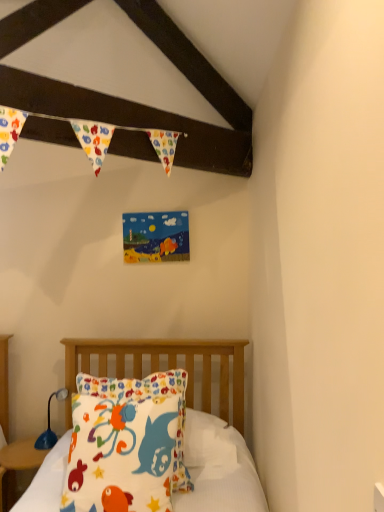
Image resolution: width=384 pixels, height=512 pixels. What do you see at coordinates (21, 455) in the screenshot? I see `matte wood nightstand at lower left` at bounding box center [21, 455].

What do you see at coordinates (126, 441) in the screenshot? This screenshot has height=512, width=384. I see `fluffy cotton pillow at lower left` at bounding box center [126, 441].

Describe the element at coordinates (189, 406) in the screenshot. I see `white cotton pillow at center` at that location.

This screenshot has width=384, height=512. Describe the element at coordinates (49, 424) in the screenshot. I see `blue plastic lamp at lower left` at that location.

Identify the location of matte wood nightstand at lower left. The height and width of the screenshot is (512, 384). (21, 455).

Between fluffy cotton pillow at lower left and blue plastic lamp at lower left, which one has smaller size?

With smaller size is blue plastic lamp at lower left.

Are fluffy cotton pillow at lower left and blue plastic lamp at lower left far apart?

fluffy cotton pillow at lower left is actually quite close to blue plastic lamp at lower left.

From the picture: How many degrees apart are the facing directions of fluffy cotton pillow at lower left and blue plastic lamp at lower left?

The facing directions of fluffy cotton pillow at lower left and blue plastic lamp at lower left are 34.7 degrees apart.

From a real-world perspective, is fluffy cotton pillow at lower left positioned above or below blue plastic lamp at lower left?

From a real-world perspective, fluffy cotton pillow at lower left is physically above blue plastic lamp at lower left.

Is white cotton pillow at center looking in the opposite direction of fluffy cotton pillow at lower left?

Absolutely, white cotton pillow at center is directed away from fluffy cotton pillow at lower left.

I want to click on pillow above the white cotton pillow at center (from a real-world perspective), so click(126, 441).

From the image's perspective, is white cotton pillow at center located beneath fluffy cotton pillow at lower left?

Yes, from the image's perspective, white cotton pillow at center is below fluffy cotton pillow at lower left.

How many degrees apart are the facing directions of fluffy cotton pillow at lower left and matte wood nightstand at lower left?

17.5 degrees separate the facing orientations of fluffy cotton pillow at lower left and matte wood nightstand at lower left.

Is fluffy cotton pillow at lower left at the right side of matte wood nightstand at lower left?

Correct, you'll find fluffy cotton pillow at lower left to the right of matte wood nightstand at lower left.

Which object is closer to the camera, fluffy cotton pillow at lower left or matte wood nightstand at lower left?

fluffy cotton pillow at lower left is closer to the camera.

Is white cotton pillow at center inside or outside of matte wood nightstand at lower left?

white cotton pillow at center is outside matte wood nightstand at lower left.

Is point (154, 364) closer or farther from the camera than point (31, 445)?

Point (154, 364).

Which of these two, matte wood nightstand at lower left or white cotton pillow at center, is wider?

matte wood nightstand at lower left is wider.

Between matte wood nightstand at lower left and white cotton pillow at center, which one appears on the right side from the viewer's perspective?

white cotton pillow at center is more to the right.

From a real-world perspective, is matte wood nightstand at lower left above or below white cotton pillow at center?

matte wood nightstand at lower left is below white cotton pillow at center.

You are a GUI agent. You are given a task and a screenshot of the screen. Output one action in this format:
    pyautogui.click(x=<x>, y=<y>)
    Task: Click on the bed to the right of matte wood nightstand at lower left
    
    Given the screenshot: What is the action you would take?
    click(189, 406)

Is blue plastic lamp at lower left at the back of matte wood nightstand at lower left?

No, matte wood nightstand at lower left is not facing away from blue plastic lamp at lower left.

Is matte wood nightstand at lower left smaller than blue plastic lamp at lower left?

No, matte wood nightstand at lower left is not smaller than blue plastic lamp at lower left.

Can you confirm if matte wood nightstand at lower left is taller than blue plastic lamp at lower left?

Yes, matte wood nightstand at lower left is taller than blue plastic lamp at lower left.

Which object is further away from the camera, matte wood nightstand at lower left or blue plastic lamp at lower left?

blue plastic lamp at lower left is more distant.

Looking at their sizes, would you say blue plastic lamp at lower left is wider or thinner than fluffy cotton pillow at lower left?

blue plastic lamp at lower left is thinner than fluffy cotton pillow at lower left.

From a real-world perspective, is blue plastic lamp at lower left physically located above or below fluffy cotton pillow at lower left?

blue plastic lamp at lower left is below fluffy cotton pillow at lower left.

Is blue plastic lamp at lower left aimed at fluffy cotton pillow at lower left?

No.

Find the location of `lamp below the fluffy cotton pillow at lower left (from a real-world perspective)`. lamp below the fluffy cotton pillow at lower left (from a real-world perspective) is located at coordinates (49, 424).

Find the location of a particular element. pillow that appears above the white cotton pillow at center (from the image's perspective) is located at coordinates (126, 441).

Considering their positions, is matte wood nightstand at lower left positioned closer to fluffy cotton pillow at lower left than white cotton pillow at center?

white cotton pillow at center lies closer to fluffy cotton pillow at lower left than the other object.

Which object lies further to the anchor point white cotton pillow at center, fluffy cotton pillow at lower left or blue plastic lamp at lower left?

Among the two, fluffy cotton pillow at lower left is located further to white cotton pillow at center.

From the image, which object appears to be nearer to blue plastic lamp at lower left, matte wood nightstand at lower left or white cotton pillow at center?

Among the two, matte wood nightstand at lower left is located nearer to blue plastic lamp at lower left.

Estimate the real-world distances between objects in this image. Which object is closer to white cotton pillow at center, matte wood nightstand at lower left or blue plastic lamp at lower left?

blue plastic lamp at lower left is positioned closer to the anchor white cotton pillow at center.

Based on their spatial positions, is fluffy cotton pillow at lower left or white cotton pillow at center further from blue plastic lamp at lower left?

fluffy cotton pillow at lower left is positioned further to the anchor blue plastic lamp at lower left.

Looking at the image, which one is located closer to matte wood nightstand at lower left, blue plastic lamp at lower left or white cotton pillow at center?

Among the two, blue plastic lamp at lower left is located nearer to matte wood nightstand at lower left.

From the image, which object appears to be farther from fluffy cotton pillow at lower left, matte wood nightstand at lower left or blue plastic lamp at lower left?

matte wood nightstand at lower left lies further to fluffy cotton pillow at lower left than the other object.

Which object lies further to the anchor point matte wood nightstand at lower left, fluffy cotton pillow at lower left or white cotton pillow at center?

fluffy cotton pillow at lower left lies further to matte wood nightstand at lower left than the other object.

Where is `bed between fluffy cotton pillow at lower left and blue plastic lamp at lower left from front to back`? bed between fluffy cotton pillow at lower left and blue plastic lamp at lower left from front to back is located at coordinates (189, 406).

Where is `nightstand between fluffy cotton pillow at lower left and blue plastic lamp at lower left along the z-axis`? nightstand between fluffy cotton pillow at lower left and blue plastic lamp at lower left along the z-axis is located at coordinates (21, 455).

Find the location of a particular element. The width and height of the screenshot is (384, 512). bed located between fluffy cotton pillow at lower left and matte wood nightstand at lower left in the depth direction is located at coordinates (189, 406).

Find the location of `nightstand positioned between white cotton pillow at center and blue plastic lamp at lower left from near to far`. nightstand positioned between white cotton pillow at center and blue plastic lamp at lower left from near to far is located at coordinates (21, 455).